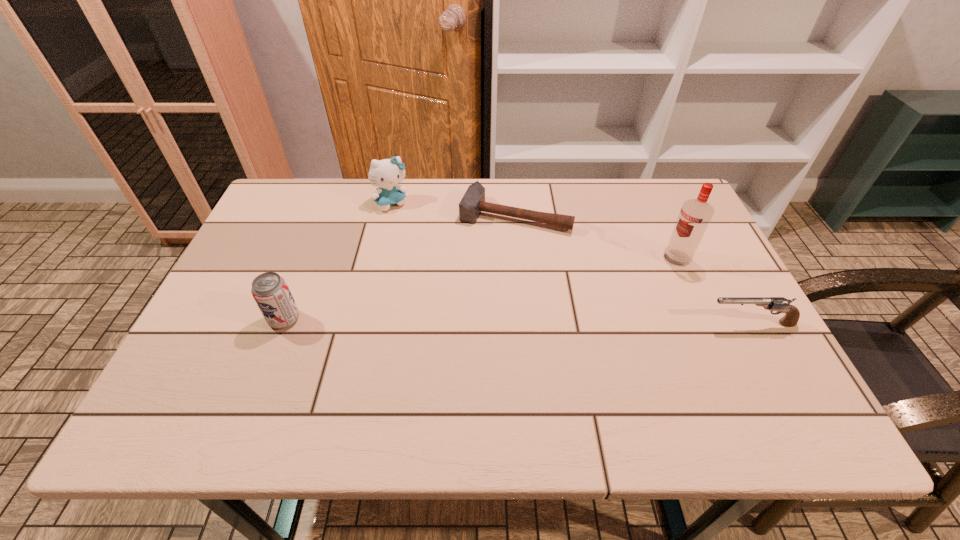
At what (x,y) coordinates should I click in order to perform the action: click on vacant area situated 0.250m on the front label of the vodka. Please return your answer as a coordinate pair (x, y). Looking at the image, I should click on (601, 305).

You are a GUI agent. You are given a task and a screenshot of the screen. Output one action in this format:
    pyautogui.click(x=<x>, y=<y>)
    Task: Click on the vacant space situated on the front label of the vodka
    The width and height of the screenshot is (960, 540).
    Given the screenshot: What is the action you would take?
    pyautogui.click(x=564, y=327)

At what (x,y) coordinates should I click in order to perform the action: click on hammer at the far edge. Please return your answer as a coordinate pair (x, y). This screenshot has height=540, width=960. Looking at the image, I should click on (473, 202).

You are a GUI agent. You are given a task and a screenshot of the screen. Output one action in this format:
    pyautogui.click(x=<x>, y=<y>)
    Task: Click on the kitten that is positioned at the far edge
    The height and width of the screenshot is (540, 960).
    Given the screenshot: What is the action you would take?
    pyautogui.click(x=385, y=174)

Find the location of a particular element. The height and width of the screenshot is (540, 960). object located in the left edge section of the desktop is located at coordinates (270, 291).

Locate an element on the screen. gun positioned at the right edge is located at coordinates (780, 304).

In order to click on vodka situated at the right edge in this screenshot , I will do `click(695, 215)`.

The height and width of the screenshot is (540, 960). In order to click on vacant space at the far edge of the desktop in this screenshot , I will do `click(640, 218)`.

Find the location of a particular element. vacant space at the left edge is located at coordinates (296, 230).

Locate an element on the screen. vacant space at the far left corner is located at coordinates (295, 202).